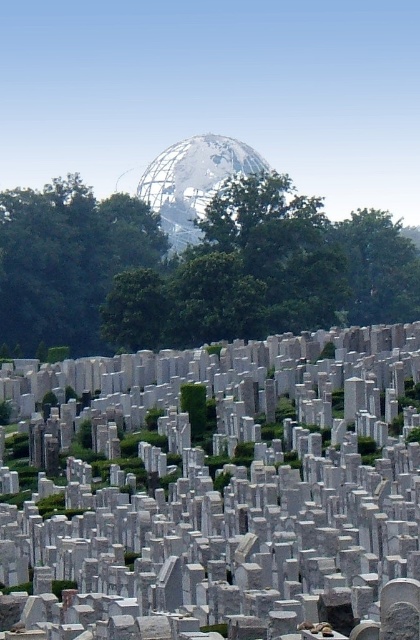
Question: In this image, where is white marble gravestone at center located relative to green leafy tree at upper center?

Choices:
 (A) left
 (B) right

Answer: (B)

Question: Which point is closer to the camera?

Choices:
 (A) green leafy tree at center
 (B) green leafy tree at upper center

Answer: (B)

Question: Among these points, which one is farthest from the camera?

Choices:
 (A) (28, 304)
 (B) (178, 468)

Answer: (A)

Question: Estimate the real-world distances between objects in this image. Which object is farther from the green leafy tree at center?

Choices:
 (A) white marble gravestone at center
 (B) green leafy tree at upper center

Answer: (A)

Question: Can you confirm if green leafy tree at upper center is positioned to the left of green leafy tree at center?

Choices:
 (A) yes
 (B) no

Answer: (B)

Question: Considering the relative positions of green leafy tree at upper center and green leafy tree at center in the image provided, where is green leafy tree at upper center located with respect to green leafy tree at center?

Choices:
 (A) below
 (B) above

Answer: (B)